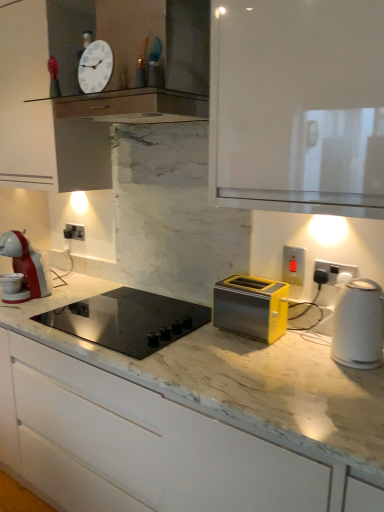
Measure the distance between point (336,264) and camera.

4.81 feet.

What is the approximate height of yellow metallic toaster at center, the 2th cabinetry in the top-to-bottom sequence?

yellow metallic toaster at center, the 2th cabinetry in the top-to-bottom sequence, is 38.71 inches in height.

Describe the element at coordinates (293, 265) in the screenshot. Image resolution: width=384 pixels, height=512 pixels. I see `matte plastic switch at upper right, the 2th electric outlet positioned from the right` at that location.

How much space does matte plastic switch at upper right, which appears as the second electric outlet when viewed from the front, occupy horizontally?

matte plastic switch at upper right, which appears as the second electric outlet when viewed from the front, is 1.27 inches wide.

This screenshot has width=384, height=512. What do you see at coordinates (74, 232) in the screenshot?
I see `satin silver socket at center, the third electric outlet in the right-to-left sequence` at bounding box center [74, 232].

I want to click on white glossy kettle at right, so click(358, 325).

Locate an element on the screen. The width and height of the screenshot is (384, 512). white plastic electric outlet at right, the 3th electric outlet from the left is located at coordinates pos(336,271).

Looking at this image, can you confirm if white glossy cabinet at upper center, marked as the 1th cabinetry in a top-to-bottom arrangement, is thinner than white plastic electric outlet at right, arranged as the third electric outlet when viewed from the back?

No, white glossy cabinet at upper center, marked as the 1th cabinetry in a top-to-bottom arrangement, is not thinner than white plastic electric outlet at right, arranged as the third electric outlet when viewed from the back.

Is white glossy cabinet at upper center, marked as the 1th cabinetry in a top-to-bottom arrangement, bigger than white plastic electric outlet at right, the 3th electric outlet from the left?

Correct, white glossy cabinet at upper center, marked as the 1th cabinetry in a top-to-bottom arrangement, is larger in size than white plastic electric outlet at right, the 3th electric outlet from the left.

Considering the relative sizes of white glossy cabinet at upper center, the second cabinetry when ordered from bottom to top, and white plastic electric outlet at right, the 3th electric outlet from the left, in the image provided, is white glossy cabinet at upper center, the second cabinetry when ordered from bottom to top, taller than white plastic electric outlet at right, the 3th electric outlet from the left,?

Indeed, white glossy cabinet at upper center, the second cabinetry when ordered from bottom to top, has a greater height compared to white plastic electric outlet at right, the 3th electric outlet from the left.

From the image's perspective, is white glossy cabinet at upper center, marked as the 1th cabinetry in a top-to-bottom arrangement, positioned above or below white plastic electric outlet at right, positioned as the first electric outlet in right-to-left order?

white glossy cabinet at upper center, marked as the 1th cabinetry in a top-to-bottom arrangement, is situated higher than white plastic electric outlet at right, positioned as the first electric outlet in right-to-left order, in the image.

How different are the orientations of satin silver socket at center, the third electric outlet in the right-to-left sequence, and black glass cooktop at center in degrees?

The angle between the facing direction of satin silver socket at center, the third electric outlet in the right-to-left sequence, and the facing direction of black glass cooktop at center is 13.5 degrees.

From a real-world perspective, which is physically above, satin silver socket at center, the third electric outlet in the right-to-left sequence, or black glass cooktop at center?

satin silver socket at center, the third electric outlet in the right-to-left sequence, from a real-world perspective.

Is point (77, 225) more distant than point (168, 297)?

Yes.

Which is closer, (x=70, y=234) or (x=58, y=417)?

Point (x=70, y=234) is positioned farther from the camera compared to point (x=58, y=417).

From a real-world perspective, does satin silver socket at center, acting as the 1th electric outlet starting from the left, sit lower than yellow metallic toaster at center, marked as the 1th cabinetry in a bottom-to-top arrangement?

No.

Can you confirm if satin silver socket at center, the third electric outlet in the right-to-left sequence, is shorter than yellow metallic toaster at center, marked as the 1th cabinetry in a bottom-to-top arrangement?

Yes, satin silver socket at center, the third electric outlet in the right-to-left sequence, is shorter than yellow metallic toaster at center, marked as the 1th cabinetry in a bottom-to-top arrangement.

In the image, is satin silver socket at center, the third electric outlet in the right-to-left sequence, on the left side or the right side of yellow metallic toaster at center, the 2th cabinetry in the top-to-bottom sequence?

From the image, it's evident that satin silver socket at center, the third electric outlet in the right-to-left sequence, is to the left of yellow metallic toaster at center, the 2th cabinetry in the top-to-bottom sequence.

Considering their positions, is yellow metallic toaster at center, the 2th cabinetry in the top-to-bottom sequence, located in front of or behind satin silver socket at center, the first electric outlet from the back?

Clearly, yellow metallic toaster at center, the 2th cabinetry in the top-to-bottom sequence, is in front of satin silver socket at center, the first electric outlet from the back.

Starting from the yellow metallic toaster at center, marked as the 1th cabinetry in a bottom-to-top arrangement, which electric outlet is the 3rd one behind? Please provide its 2D coordinates.

[(74, 232)]

From a real-world perspective, between yellow metallic toaster at center, the 2th cabinetry in the top-to-bottom sequence, and satin silver socket at center, which is the 3th electric outlet in front-to-back order, who is vertically higher?

From a 3D spatial view, satin silver socket at center, which is the 3th electric outlet in front-to-back order, is above.

Is yellow metallic toaster at center, marked as the 1th cabinetry in a bottom-to-top arrangement, with satin silver socket at center, acting as the 1th electric outlet starting from the left?

No, yellow metallic toaster at center, marked as the 1th cabinetry in a bottom-to-top arrangement, is not touching satin silver socket at center, acting as the 1th electric outlet starting from the left.

From the image's perspective, is matte plastic switch at upper right, the 2th electric outlet positioned from the right, below white glossy clock at upper center?

Yes, from the image's perspective, matte plastic switch at upper right, the 2th electric outlet positioned from the right, is below white glossy clock at upper center.

Considering their positions, is matte plastic switch at upper right, the 2th electric outlet positioned from the right, located in front of or behind white glossy clock at upper center?

Clearly, matte plastic switch at upper right, the 2th electric outlet positioned from the right, is behind white glossy clock at upper center.

Can you confirm if matte plastic switch at upper right, the 2th electric outlet positioned from the right, is bigger than white glossy clock at upper center?

Actually, matte plastic switch at upper right, the 2th electric outlet positioned from the right, might be smaller than white glossy clock at upper center.

Consider the image. Which is more to the right, matte plastic switch at upper right, placed as the second electric outlet when sorted from back to front, or white glossy clock at upper center?

matte plastic switch at upper right, placed as the second electric outlet when sorted from back to front, is more to the right.

Is matte plastic switch at upper right, which appears as the second electric outlet when viewed from the front, surrounding satin silver socket at center, the third electric outlet in the right-to-left sequence?

No, satin silver socket at center, the third electric outlet in the right-to-left sequence, is located outside of matte plastic switch at upper right, which appears as the second electric outlet when viewed from the front.

Would you consider matte plastic switch at upper right, the 2th electric outlet positioned from the right, to be distant from satin silver socket at center, which is the 3th electric outlet in front-to-back order?

matte plastic switch at upper right, the 2th electric outlet positioned from the right, is positioned a significant distance from satin silver socket at center, which is the 3th electric outlet in front-to-back order.

Between matte plastic switch at upper right, the 2th electric outlet in the left-to-right sequence, and satin silver socket at center, acting as the 1th electric outlet starting from the left, which one appears on the left side from the viewer's perspective?

From the viewer's perspective, satin silver socket at center, acting as the 1th electric outlet starting from the left, appears more on the left side.

Who is more distant, matte plastic switch at upper right, the 2th electric outlet in the left-to-right sequence, or satin silver socket at center, the first electric outlet from the back?

satin silver socket at center, the first electric outlet from the back.

Is point (363, 342) less distant than point (67, 231)?

Yes, point (363, 342) is closer to viewer.

Considering their positions, is white glossy kettle at right located in front of or behind satin silver socket at center, the third electric outlet in the right-to-left sequence?

In the image, white glossy kettle at right appears in front of satin silver socket at center, the third electric outlet in the right-to-left sequence.

Is white glossy kettle at right inside or outside of satin silver socket at center, the third electric outlet in the right-to-left sequence?

white glossy kettle at right is outside satin silver socket at center, the third electric outlet in the right-to-left sequence.

From the image's perspective, relative to satin silver socket at center, acting as the 1th electric outlet starting from the left, is white glossy kettle at right above or below?

From the image's perspective, white glossy kettle at right appears below satin silver socket at center, acting as the 1th electric outlet starting from the left.

The image size is (384, 512). I want to click on electric outlet that is the 3rd one below the white glossy cabinet at upper center, marked as the 1th cabinetry in a top-to-bottom arrangement (from a real-world perspective), so click(336, 271).

The image size is (384, 512). I want to click on the 3rd electric outlet above the black glass cooktop at center (from the image's perspective), so click(74, 232).

Considering their positions, is white glossy clock at upper center positioned closer to white glossy cabinet at upper center, the second cabinetry when ordered from bottom to top, than black glass cooktop at center?

white glossy clock at upper center is positioned closer to the anchor white glossy cabinet at upper center, the second cabinetry when ordered from bottom to top.

Estimate the real-world distances between objects in this image. Which object is further from yellow metallic toaster at center, marked as the 1th cabinetry in a bottom-to-top arrangement, satin silver socket at center, the first electric outlet from the back, or matte plastic switch at upper right, the 2th electric outlet in the left-to-right sequence?

The object further to yellow metallic toaster at center, marked as the 1th cabinetry in a bottom-to-top arrangement, is satin silver socket at center, the first electric outlet from the back.

From the image, which object appears to be nearer to satin silver socket at center, acting as the 1th electric outlet starting from the left, matte plastic switch at upper right, placed as the second electric outlet when sorted from back to front, or yellow metallic toaster at center, the 2th cabinetry in the top-to-bottom sequence?

yellow metallic toaster at center, the 2th cabinetry in the top-to-bottom sequence, is positioned closer to the anchor satin silver socket at center, acting as the 1th electric outlet starting from the left.

From the image, which object appears to be nearer to white glossy kettle at right, white glossy clock at upper center or matte plastic switch at upper right, the 2th electric outlet in the left-to-right sequence?

matte plastic switch at upper right, the 2th electric outlet in the left-to-right sequence, lies closer to white glossy kettle at right than the other object.

Based on the photo, estimate the real-world distances between objects in this image. Which object is closer to matte plastic switch at upper right, the 2th electric outlet in the left-to-right sequence, white glossy cabinet at upper center, the second cabinetry when ordered from bottom to top, or satin silver socket at center, the first electric outlet from the back?

Among the two, white glossy cabinet at upper center, the second cabinetry when ordered from bottom to top, is located nearer to matte plastic switch at upper right, the 2th electric outlet in the left-to-right sequence.

Estimate the real-world distances between objects in this image. Which object is closer to white glossy cabinet at upper center, marked as the 1th cabinetry in a top-to-bottom arrangement, yellow metallic toaster at center, the 2th cabinetry in the top-to-bottom sequence, or white glossy clock at upper center?

The object closer to white glossy cabinet at upper center, marked as the 1th cabinetry in a top-to-bottom arrangement, is white glossy clock at upper center.

Considering their positions, is matte plastic switch at upper right, placed as the second electric outlet when sorted from back to front, positioned closer to yellow metallic toaster at center, marked as the 1th cabinetry in a bottom-to-top arrangement, than white glossy clock at upper center?

matte plastic switch at upper right, placed as the second electric outlet when sorted from back to front, lies closer to yellow metallic toaster at center, marked as the 1th cabinetry in a bottom-to-top arrangement, than the other object.

When comparing their distances from matte plastic switch at upper right, the 2th electric outlet positioned from the right, does white glossy cabinet at upper center, marked as the 1th cabinetry in a top-to-bottom arrangement, or white glossy kettle at right seem further?

white glossy cabinet at upper center, marked as the 1th cabinetry in a top-to-bottom arrangement, lies further to matte plastic switch at upper right, the 2th electric outlet positioned from the right, than the other object.

This screenshot has height=512, width=384. Find the location of `home appliance between white glossy cabinet at upper center, the second cabinetry when ordered from bottom to top, and yellow metallic toaster at center, marked as the 1th cabinetry in a bottom-to-top arrangement, in the up-down direction`. home appliance between white glossy cabinet at upper center, the second cabinetry when ordered from bottom to top, and yellow metallic toaster at center, marked as the 1th cabinetry in a bottom-to-top arrangement, in the up-down direction is located at coordinates (128, 320).

At what (x,y) coordinates should I click in order to perform the action: click on clock between white glossy cabinet at upper center, marked as the 1th cabinetry in a top-to-bottom arrangement, and matte plastic switch at upper right, which appears as the second electric outlet when viewed from the front, in the up-down direction. Please return your answer as a coordinate pair (x, y). Looking at the image, I should click on (95, 67).

In order to click on electric outlet between white glossy kettle at right and matte plastic switch at upper right, which appears as the second electric outlet when viewed from the front, along the z-axis in this screenshot , I will do `click(336, 271)`.

You are a GUI agent. You are given a task and a screenshot of the screen. Output one action in this format:
    pyautogui.click(x=<x>, y=<y>)
    Task: Click on the kitchen appliance between white glossy cabinet at upper center, the second cabinetry when ordered from bottom to top, and black glass cooktop at center vertically
    
    Given the screenshot: What is the action you would take?
    pyautogui.click(x=358, y=325)